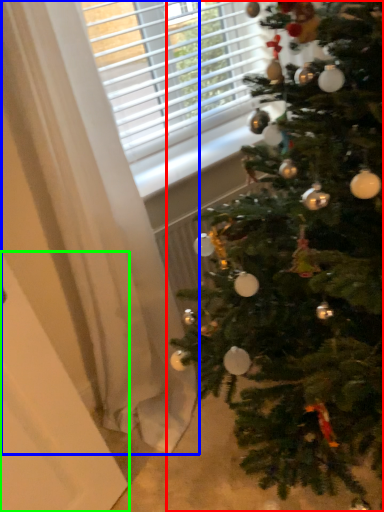
Question: Estimate the real-world distances between objects in this image. Which object is closer to christmas tree (highlighted by a red box), curtain (highlighted by a blue box) or screen door (highlighted by a green box)?

Choices:
 (A) curtain
 (B) screen door

Answer: (A)